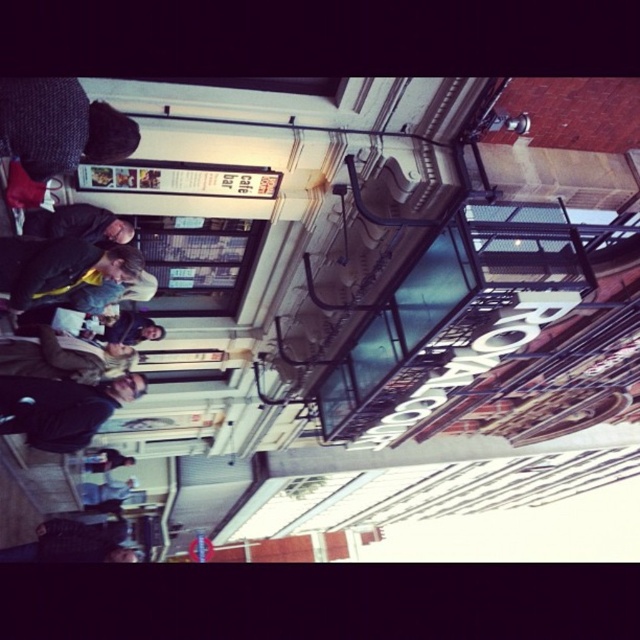
You are a photographer who wants to capture both the knitted dark gray hat at upper left and the dark blue jacket at lower left in a single frame. Given the current rotation of the image, which direction should you move the camera to ensure both objects are visible?

Since the knitted dark gray hat at upper left is above the dark blue jacket at lower left, you should move the camera upward to include both objects in the frame.

Consider the image. You are standing in front of the Royal Court venue and want to take a photo that includes both the Royal Court sign and the cafe advertisement. You notice two points marked on the ground at coordinates point (131,140) and point (74,234). Which point should you stand closer to in order to ensure both the sign and the cafe advertisement are clearly visible in your photo?

You should stand closer to point (131,140) because it is closer to the viewer, allowing both the Royal Court sign and the cafe advertisement to be in clear view.